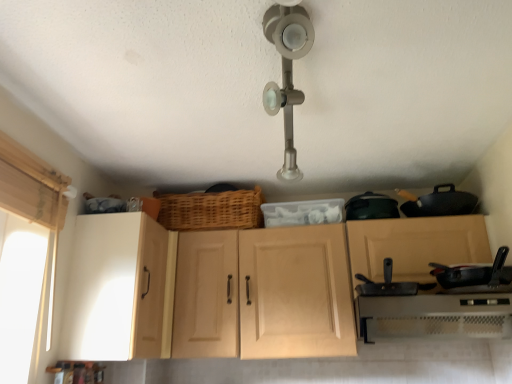
Question: Is white plastic oven at lower right at the left side of black matte frying pan at center, which is counted as the second frying pan, starting from the right?

Choices:
 (A) no
 (B) yes

Answer: (A)

Question: Is white plastic oven at lower right positioned far away from black matte frying pan at center, which ranks as the first frying pan in left-to-right order?

Choices:
 (A) no
 (B) yes

Answer: (A)

Question: From a real-world perspective, is white plastic oven at lower right physically below black matte frying pan at center, which is counted as the second frying pan, starting from the right?

Choices:
 (A) yes
 (B) no

Answer: (A)

Question: Does white plastic oven at lower right have a lesser width compared to black matte frying pan at center, which is counted as the second frying pan, starting from the right?

Choices:
 (A) no
 (B) yes

Answer: (A)

Question: Can we say white plastic oven at lower right lies outside black matte frying pan at center, which ranks as the first frying pan in left-to-right order?

Choices:
 (A) no
 (B) yes

Answer: (B)

Question: Would you say white plastic oven at lower right is to the left or to the right of matte wood cabinet at center, placed as the first cabinetry when sorted from right to left, in the picture?

Choices:
 (A) right
 (B) left

Answer: (A)

Question: Is white plastic oven at lower right wider or thinner than matte wood cabinet at center, placed as the first cabinetry when sorted from right to left?

Choices:
 (A) thin
 (B) wide

Answer: (A)

Question: Is white plastic oven at lower right spatially inside matte wood cabinet at center, marked as the second cabinetry in a left-to-right arrangement, or outside of it?

Choices:
 (A) inside
 (B) outside

Answer: (A)

Question: Considering the positions of white plastic oven at lower right and matte wood cabinet at center, marked as the second cabinetry in a left-to-right arrangement, in the image, is white plastic oven at lower right bigger or smaller than matte wood cabinet at center, marked as the second cabinetry in a left-to-right arrangement,?

Choices:
 (A) big
 (B) small

Answer: (B)

Question: Would you say white fabric at left is inside or outside woven wood basket at center?

Choices:
 (A) outside
 (B) inside

Answer: (A)

Question: Looking at their shapes, would you say white fabric at left is wider or thinner than woven wood basket at center?

Choices:
 (A) thin
 (B) wide

Answer: (A)

Question: From the image's perspective, is white fabric at left positioned above or below woven wood basket at center?

Choices:
 (A) above
 (B) below

Answer: (B)

Question: Looking at the image, does white fabric at left seem bigger or smaller compared to woven wood basket at center?

Choices:
 (A) big
 (B) small

Answer: (A)

Question: In the image, is white matte cabinet at left, which is the 1th cabinetry from left to right, on the left side or the right side of white plastic oven at lower right?

Choices:
 (A) right
 (B) left

Answer: (B)

Question: In terms of height, does white matte cabinet at left, marked as the 2th cabinetry in a right-to-left arrangement, look taller or shorter compared to white plastic oven at lower right?

Choices:
 (A) tall
 (B) short

Answer: (A)